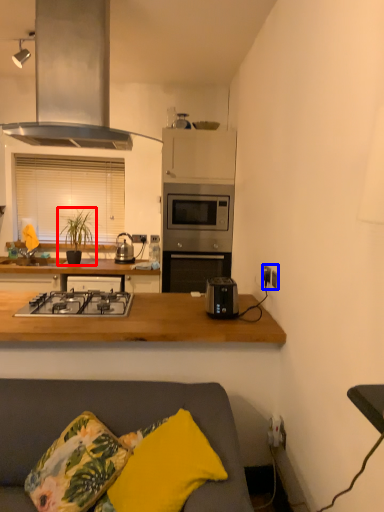
Question: Which point is closer to the camera, houseplant (highlighted by a red box) or electric outlet (highlighted by a blue box)?

Choices:
 (A) houseplant
 (B) electric outlet

Answer: (B)